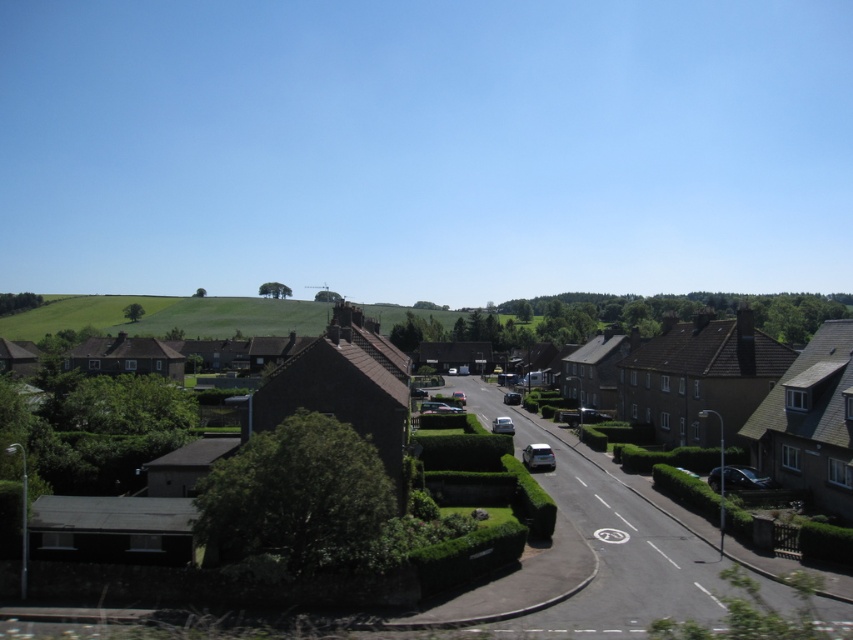
Consider the image. Who is more forward, (619, 532) or (328, 472)?

Point (328, 472) is more forward.

Image resolution: width=853 pixels, height=640 pixels. What are the coordinates of `brown brick houses at center` in the screenshot? It's located at pyautogui.click(x=601, y=552).

Find the location of `brown brick houses at center`. brown brick houses at center is located at coordinates (601, 552).

Can you confirm if green leafy hedge at center is taller than green grassy hillside at center?

Incorrect, green leafy hedge at center's height is not larger of green grassy hillside at center's.

Which is behind, point (286, 458) or point (241, 330)?

Point (241, 330)

At what (x,y) coordinates should I click in order to perform the action: click on green leafy hedge at center. Please return your answer as a coordinate pair (x, y). This screenshot has height=640, width=853. Looking at the image, I should click on point(299,497).

Between brown brick houses at center and green grassy hillside at center, which one is positioned lower?

Positioned lower is brown brick houses at center.

Is the position of brown brick houses at center more distant than that of green grassy hillside at center?

That is False.

Identify the location of brown brick houses at center. (601, 552).

Where is `brown brick houses at center`? brown brick houses at center is located at coordinates (601, 552).